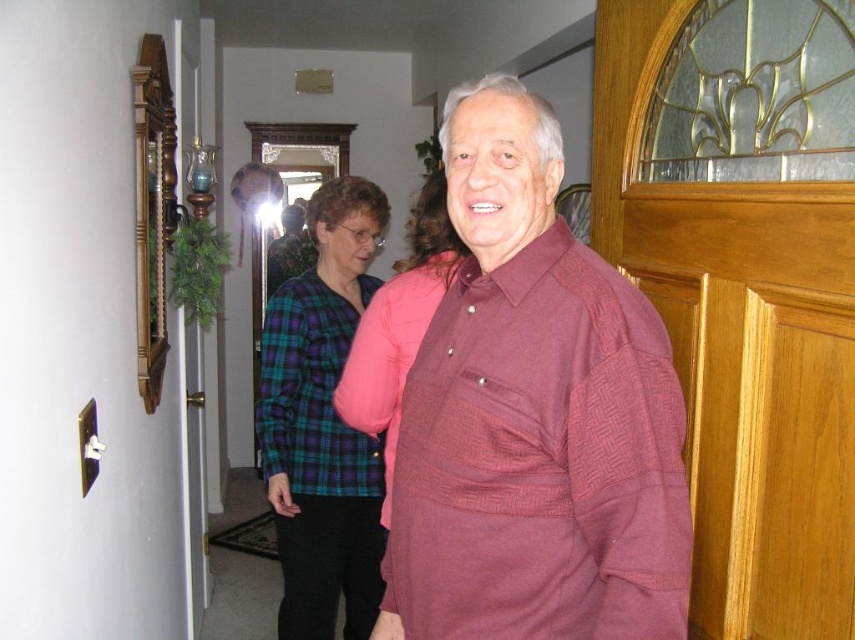
Question: Does maroon woven shirt at center have a larger size compared to plaid fabric shirt at center?

Choices:
 (A) yes
 (B) no

Answer: (B)

Question: Which of the following is the farthest from the observer?

Choices:
 (A) (317, 422)
 (B) (531, 330)
 (C) (342, 468)

Answer: (C)

Question: Can you confirm if maroon woven shirt at center is wider than green plaid shirt at center?

Choices:
 (A) no
 (B) yes

Answer: (B)

Question: Based on their relative distances, which object is nearer to the plaid fabric shirt at center?

Choices:
 (A) maroon woven shirt at center
 (B) green plaid shirt at center

Answer: (B)

Question: Is maroon woven shirt at center thinner than plaid fabric shirt at center?

Choices:
 (A) no
 (B) yes

Answer: (A)

Question: Estimate the real-world distances between objects in this image. Which object is farther from the plaid fabric shirt at center?

Choices:
 (A) green plaid shirt at center
 (B) maroon woven shirt at center

Answer: (B)